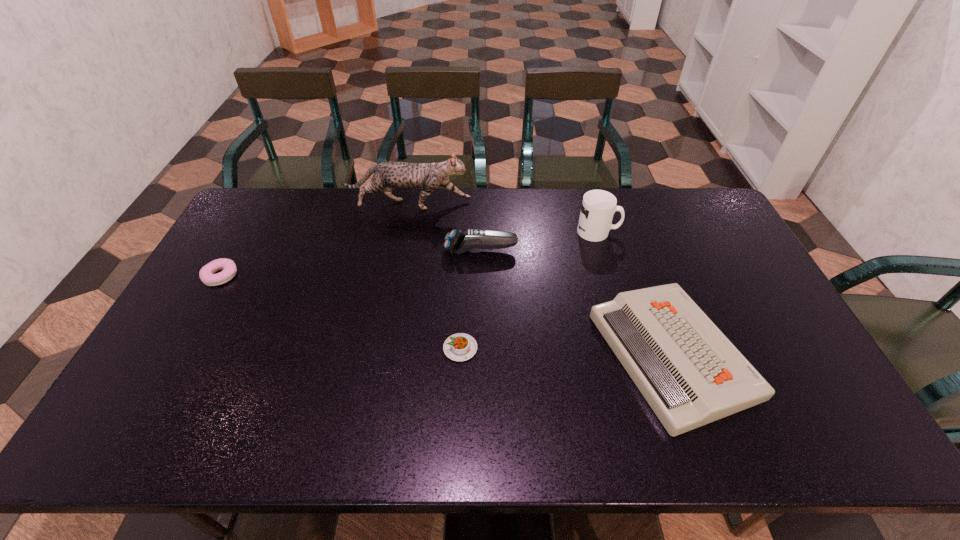
In order to click on vacant space located on the face of the farthest object in this screenshot , I will do `click(574, 205)`.

Find the location of `free spot located on the handle side of the second tallest object`. free spot located on the handle side of the second tallest object is located at coordinates (654, 231).

The image size is (960, 540). Find the location of `free space located 0.390m on the head of the fourth nearest object`. free space located 0.390m on the head of the fourth nearest object is located at coordinates (326, 251).

At what (x,y) coordinates should I click in order to perform the action: click on free space located 0.370m on the head of the fourth nearest object. Please return your answer as a coordinate pair (x, y). This screenshot has width=960, height=540. Looking at the image, I should click on (332, 251).

The image size is (960, 540). Find the location of `vacant space located 0.200m on the head of the fourth nearest object`. vacant space located 0.200m on the head of the fourth nearest object is located at coordinates (384, 251).

Identify the location of vacant space positioned on the right of the fourth tallest object. This screenshot has height=540, width=960. (800, 354).

The image size is (960, 540). I want to click on vacant region located 0.150m on the back of the leftmost object, so click(x=245, y=234).

I want to click on vacant region located 0.390m on the back of the shortest object, so click(x=465, y=241).

Locate an element on the screen. This screenshot has width=960, height=540. cat at the far edge is located at coordinates (388, 175).

The height and width of the screenshot is (540, 960). What are the coordinates of `mug present at the far edge` in the screenshot? It's located at (598, 207).